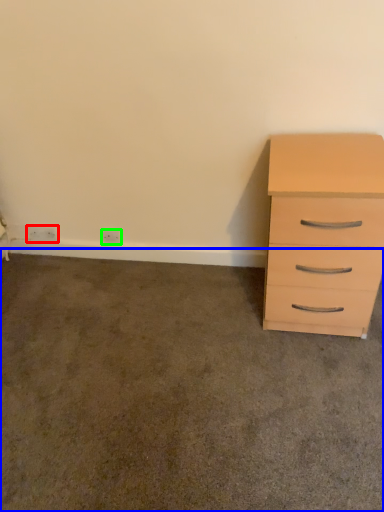
Question: Which object is the farthest from electric outlet (highlighted by a red box)? Choose among these: concrete (highlighted by a blue box) or electric outlet (highlighted by a green box).

Choices:
 (A) concrete
 (B) electric outlet

Answer: (A)